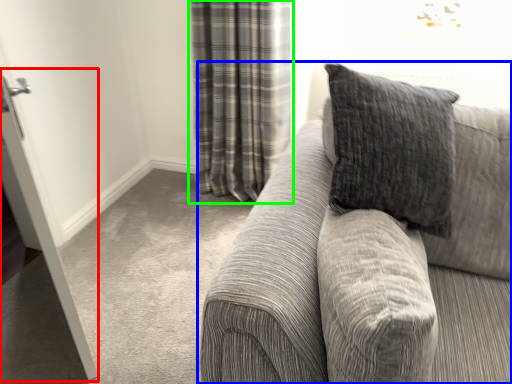
Question: Which object is the farthest from screen door (highlighted by a red box)? Choose among these: studio couch (highlighted by a blue box) or curtain (highlighted by a green box).

Choices:
 (A) studio couch
 (B) curtain

Answer: (B)